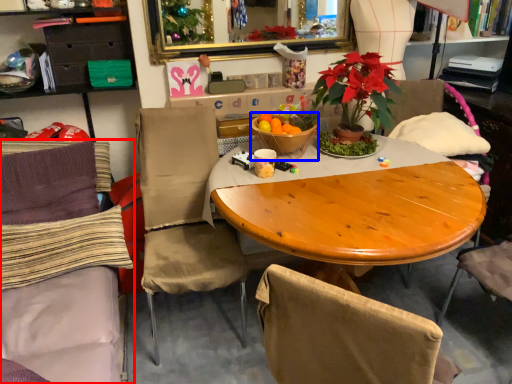
Question: Among these objects, which one is farthest to the camera, chair (highlighted by a red box) or tableware (highlighted by a blue box)?

Choices:
 (A) chair
 (B) tableware

Answer: (B)